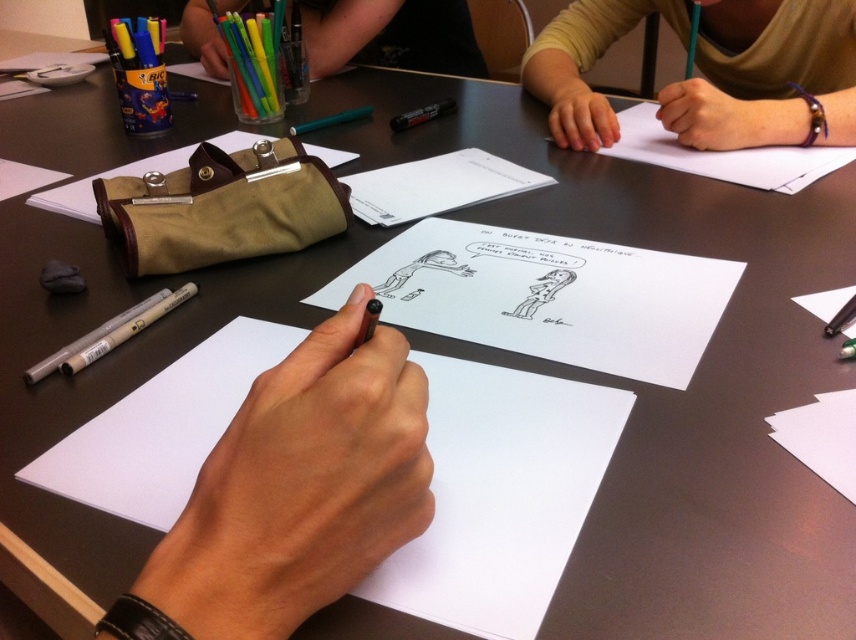
Measure the distance between matte skin hand at upper right and camera.

matte skin hand at upper right and camera are 36.56 inches apart.

Is matte skin hand at upper right to the left of matte plastic pen at upper center from the viewer's perspective?

A: In fact, matte skin hand at upper right is to the right of matte plastic pen at upper center.

Who is more forward, (593, 116) or (210, 72)?

Positioned in front is point (593, 116).

This screenshot has height=640, width=856. I want to click on matte skin hand at upper right, so click(577, 115).

Is point (753, 102) positioned in front of point (822, 154)?

That is False.

Is point (608, 16) positioned in front of point (788, 193)?

No.

This screenshot has width=856, height=640. Find the location of `matte beige pencil case at upper center`. matte beige pencil case at upper center is located at coordinates (746, 76).

Which of these two, matte plastic cup at upper center or white paper at upper right, stands shorter?

white paper at upper right is shorter.

Does matte plastic cup at upper center come in front of white paper at upper right?

No, it is not.

Find the location of `matte plastic cup at upper center`. matte plastic cup at upper center is located at coordinates (391, 35).